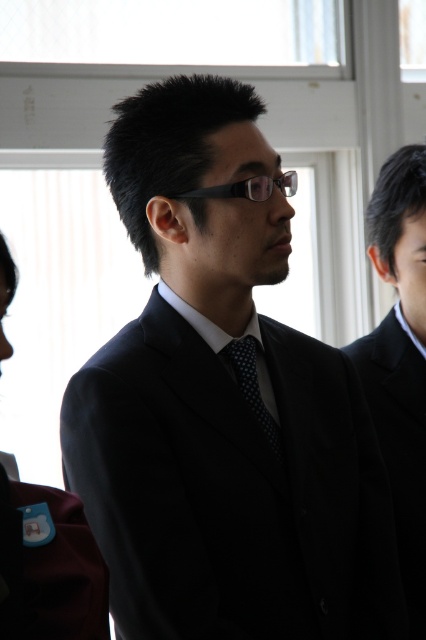
Question: Which object appears closest to the camera in this image?

Choices:
 (A) black matte suit at right
 (B) polka dot silk tie at center
 (C) maroon fabric uniform at left
 (D) matte black suit at center

Answer: (C)

Question: Is maroon fabric uniform at left wider than polka dot silk tie at center?

Choices:
 (A) no
 (B) yes

Answer: (B)

Question: Is matte black suit at center above maroon fabric uniform at left?

Choices:
 (A) no
 (B) yes

Answer: (B)

Question: Among these objects, which one is farthest from the camera?

Choices:
 (A) maroon fabric uniform at left
 (B) polka dot silk tie at center
 (C) matte black suit at center
 (D) black matte suit at right

Answer: (D)

Question: Is black matte suit at right further to the viewer compared to polka dot silk tie at center?

Choices:
 (A) no
 (B) yes

Answer: (B)

Question: Among these points, which one is nearest to the camera?

Choices:
 (A) (388, 426)
 (B) (245, 401)
 (C) (287, 529)
 (D) (37, 545)

Answer: (D)